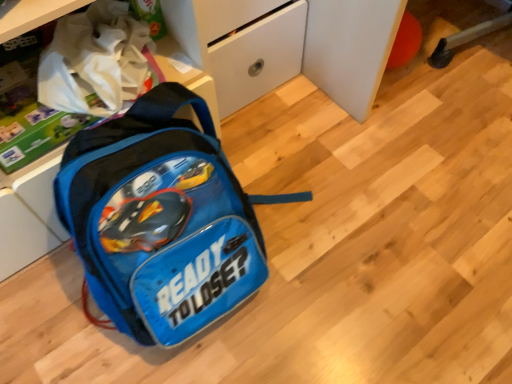
This screenshot has width=512, height=384. Find the location of `vacant area to the right of blue fabric backpack at center`. vacant area to the right of blue fabric backpack at center is located at coordinates (371, 237).